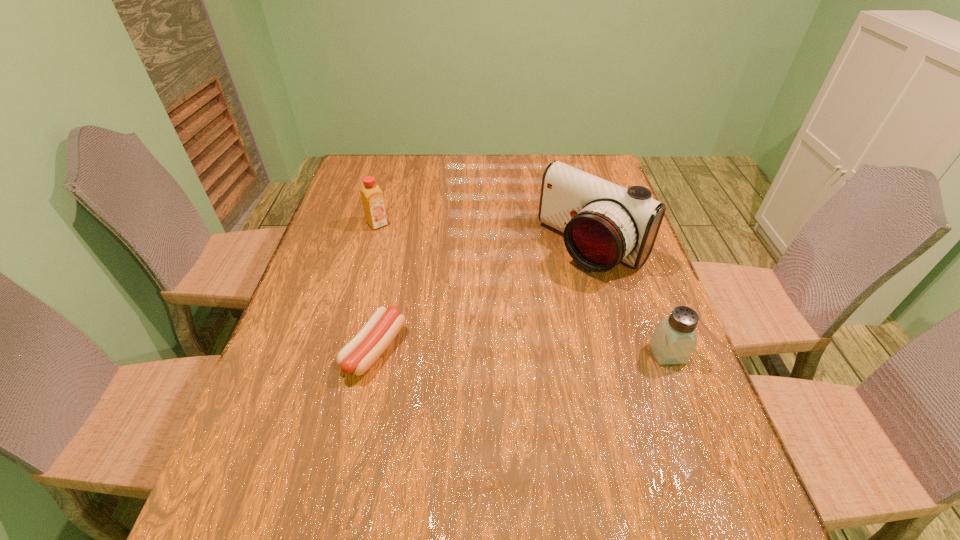
Identify the location of vacant position located on the surface of the tallest object. (541, 298).

Image resolution: width=960 pixels, height=540 pixels. I want to click on blank space located on the surface of the tallest object, so click(x=544, y=296).

Find the location of `sausage that is at the left edge`. sausage that is at the left edge is located at coordinates (357, 356).

You are a GUI agent. You are given a task and a screenshot of the screen. Output one action in this format:
    pyautogui.click(x=<x>, y=<y>)
    Task: Click on the orange juice positioned at the left edge
    This screenshot has height=540, width=960.
    Given the screenshot: What is the action you would take?
    pyautogui.click(x=372, y=197)

Locate an element on the screen. saltshaker that is at the right edge is located at coordinates 674,339.

I want to click on camcorder that is at the right edge, so click(x=603, y=223).

The width and height of the screenshot is (960, 540). In order to click on free space at the far edge of the desktop in this screenshot , I will do `click(456, 164)`.

You are a GUI agent. You are given a task and a screenshot of the screen. Output one action in this format:
    pyautogui.click(x=<x>, y=<y>)
    Task: Click on the free region at the left edge
    This screenshot has height=540, width=960.
    Given the screenshot: What is the action you would take?
    pyautogui.click(x=324, y=245)

This screenshot has width=960, height=540. In order to click on free space at the right edge in this screenshot , I will do `click(701, 415)`.

Identify the location of vacant space at the far left corner of the desktop. (387, 157).